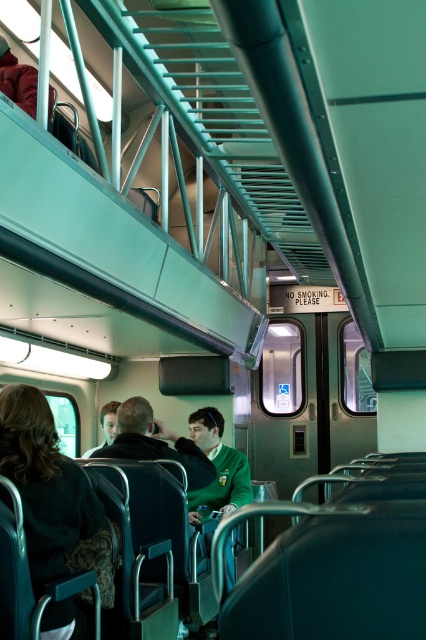
You are a passenger on the train and you see two items of clothing in the scene. The dark green sweater at lower left and the green fabric jacket at center. Which clothing item is bigger in size?

The dark green sweater at lower left is larger in size than the green fabric jacket at center.

You are a passenger trying to sit down in the train carriage. You notice two items occupying seats next to you. The dark green sweater at lower left and the green fabric jacket at center. Which item takes up more space on the seat?

The dark green sweater at lower left takes up more space on the seat because its width is larger than that of the green fabric jacket at center.

You are a passenger standing on the lower level of the train and see the dark green sweater at lower left and the green fabric jacket at center. Which clothing item is closer to you?

The dark green sweater at lower left is closer to you because it is in front of the green fabric jacket at center.